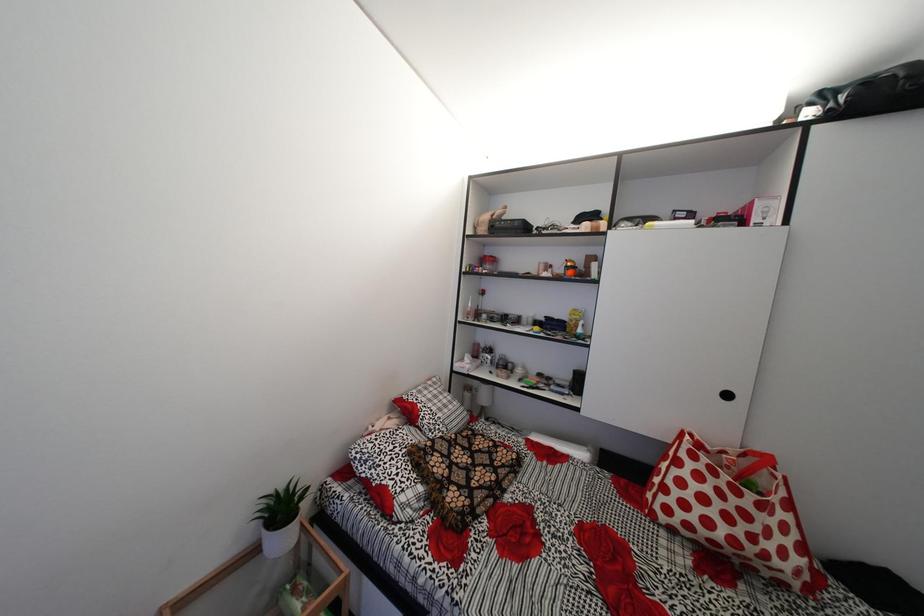
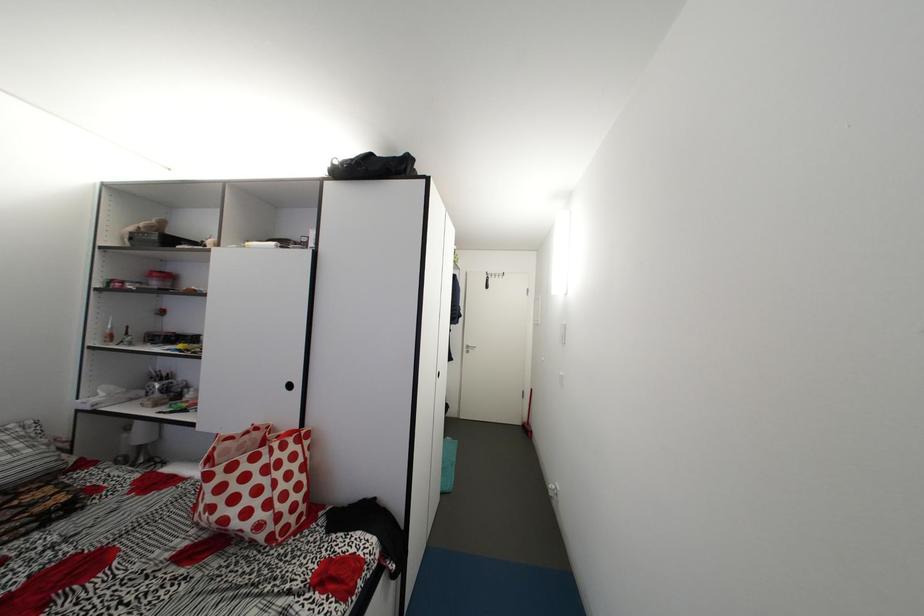
Question: In a continuous first-person perspective shot, in which direction is the camera moving?

Choices:
 (A) Left
 (B) Right
 (C) Forward
 (D) Backward

Answer: (B)